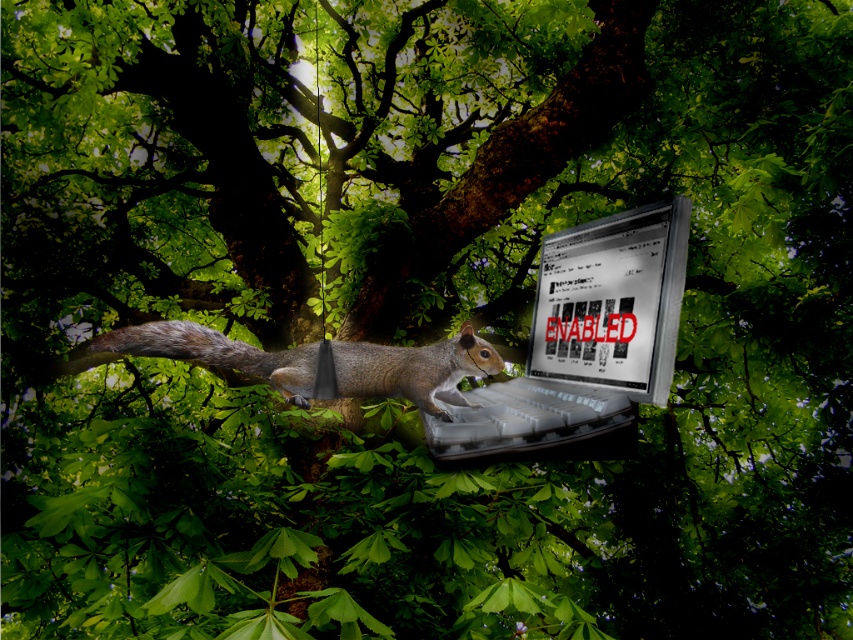
Does metallic silver laptop at center lie behind fuzzy brown tail at center?

No, it is not.

Identify the location of metallic silver laptop at center. (584, 342).

Is point (555, 396) closer to viewer compared to point (251, 369)?

Yes, point (555, 396) is closer to viewer.

Find the location of a particular element. The width and height of the screenshot is (853, 640). metallic silver laptop at center is located at coordinates (584, 342).

Is the position of shiny silver laptop at center more distant than that of gray fur squirrel at center?

No, it is in front of gray fur squirrel at center.

This screenshot has width=853, height=640. Identify the location of shiny silver laptop at center. (612, 301).

From the picture: Does gray fur squirrel at center have a smaller size compared to fuzzy brown tail at center?

No.

Who is higher up, gray fur squirrel at center or fuzzy brown tail at center?

fuzzy brown tail at center

Where is `gray fur squirrel at center`? gray fur squirrel at center is located at coordinates (415, 369).